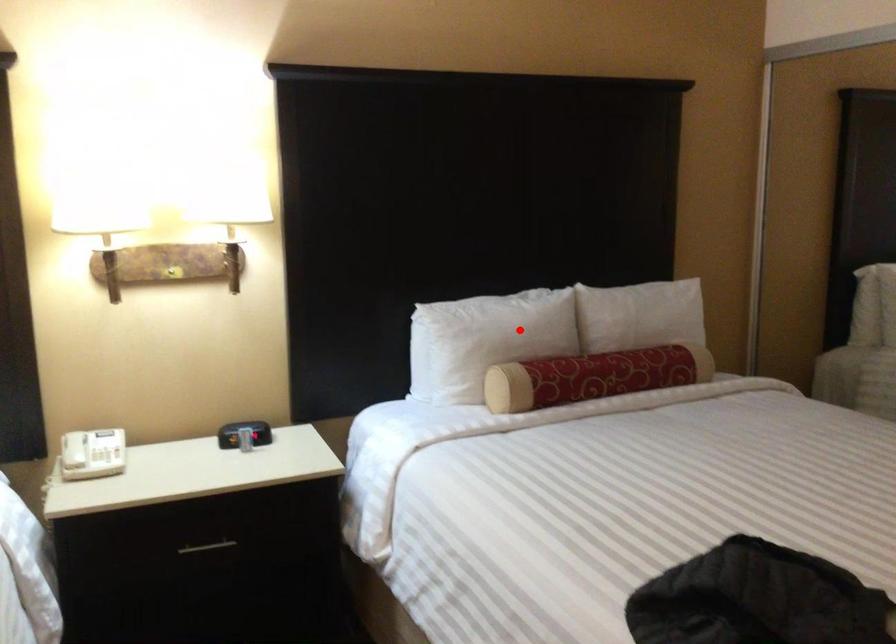
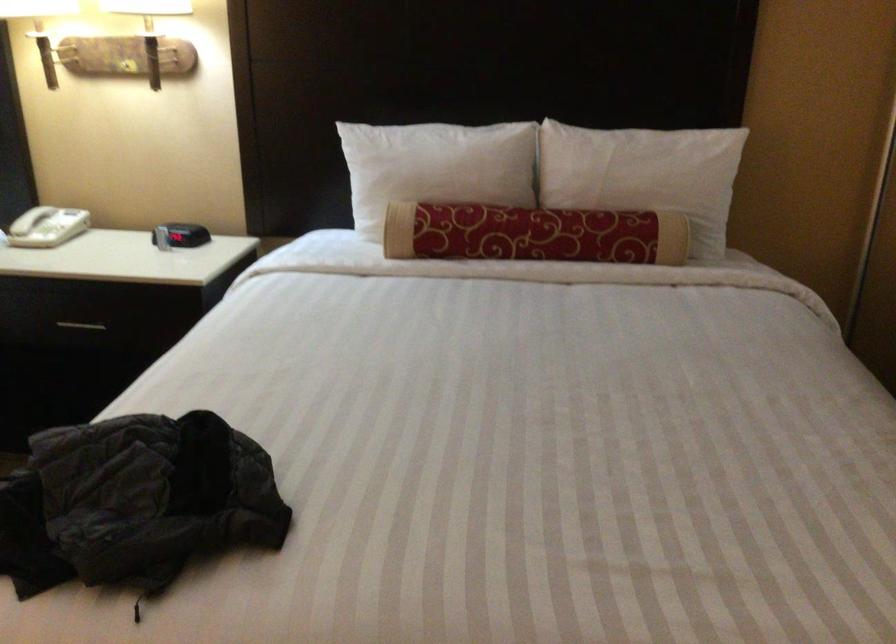
Question: I am providing you with two images of the same scene from different viewpoints. In image1, a red point is highlighted. Considering the same 3D point in image2, which of the following is correct?

Choices:
 (A) It is closer
 (B) It is farther

Answer: (A)